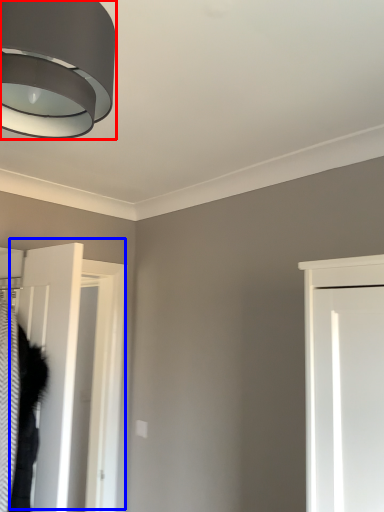
Question: Among these objects, which one is nearest to the camera, lamp (highlighted by a red box) or door (highlighted by a blue box)?

Choices:
 (A) lamp
 (B) door

Answer: (A)